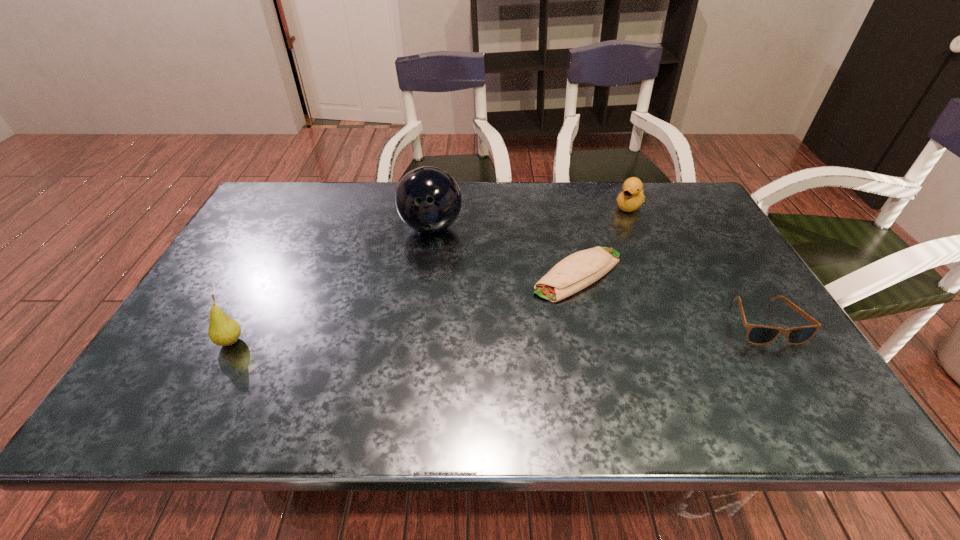
Locate an element on the screen. The height and width of the screenshot is (540, 960). vacant space at the right edge of the desktop is located at coordinates (715, 238).

In the image, there is a desktop. Where is `vacant space at the far left corner`? vacant space at the far left corner is located at coordinates (288, 192).

In the image, there is a desktop. At what (x,y) coordinates should I click in order to perform the action: click on vacant space at the near right corner. Please return your answer as a coordinate pair (x, y). This screenshot has width=960, height=540. Looking at the image, I should click on (784, 372).

This screenshot has height=540, width=960. I want to click on vacant space that is in between the third object from right to left and the leftmost object, so click(404, 308).

Locate an element on the screen. The image size is (960, 540). vacant area that lies between the leftmost object and the shortest object is located at coordinates (404, 308).

I want to click on free space between the bowling ball and the burrito, so click(x=504, y=251).

Where is `free spot between the burrito and the fourth shortest object`? free spot between the burrito and the fourth shortest object is located at coordinates (404, 308).

The height and width of the screenshot is (540, 960). Identify the location of free point between the rightmost object and the duckling. (697, 264).

The image size is (960, 540). Find the location of `vacant space that's between the fourth shortest object and the duckling`. vacant space that's between the fourth shortest object and the duckling is located at coordinates (430, 274).

At what (x,y) coordinates should I click in order to perform the action: click on empty location between the second shortest object and the leftmost object. Please return your answer as a coordinate pair (x, y). This screenshot has height=540, width=960. Looking at the image, I should click on (497, 332).